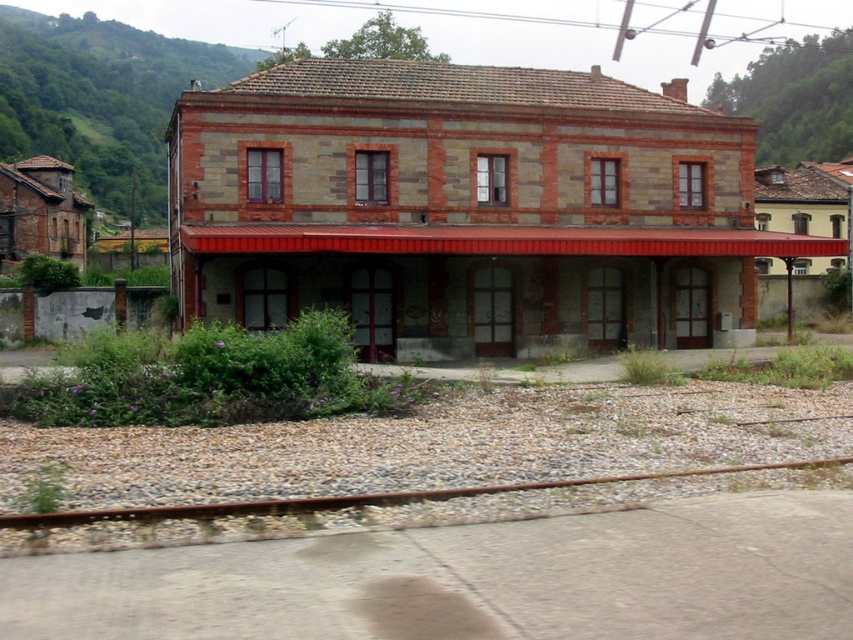
Question: Which object appears closest to the camera in this image?

Choices:
 (A) rusty metal train track at lower center
 (B) brick railway station at center
 (C) green grassy hillside at upper left

Answer: (A)

Question: Can you confirm if brick railway station at center is thinner than green grassy hillside at upper left?

Choices:
 (A) no
 (B) yes

Answer: (B)

Question: Based on their relative distances, which object is farther from the rusty metal train track at lower center?

Choices:
 (A) brick railway station at center
 (B) green grassy hillside at upper left

Answer: (B)

Question: Can you confirm if brick railway station at center is positioned to the left of rusty metal train track at lower center?

Choices:
 (A) no
 (B) yes

Answer: (A)

Question: Which object appears closest to the camera in this image?

Choices:
 (A) green grassy hillside at upper left
 (B) rusty metal train track at lower center
 (C) brick railway station at center

Answer: (B)

Question: Is green grassy hillside at upper left to the left of rusty metal train track at lower center from the viewer's perspective?

Choices:
 (A) yes
 (B) no

Answer: (A)